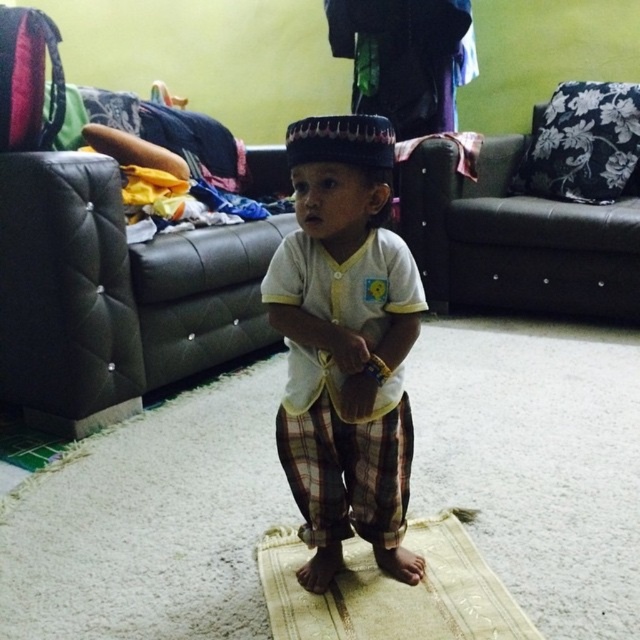
You are a parent trying to organize your child room. You see the white cotton shirt at center and the beige woven mat at center. Which item is positioned to the left side?

The white cotton shirt at center is to the left of the beige woven mat at center.

You are a photographer setting up for a portrait. You notice the white cotton shirt at center and the beige woven mat at center in the scene. Which object should you focus on first to ensure it is in sharp focus if you want the closest object to be clear?

The white cotton shirt at center is closer to the viewer than the beige woven mat at center, so you should focus on the white cotton shirt at center first to ensure it is in sharp focus.

You are helping a child get dressed. The child is standing on the beige woven mat at center and wearing the white cotton shirt at center. Can you tell me if the shirt is covering the mat?

The white cotton shirt at center is positioned over beige woven mat at center, so yes, the shirt is covering the mat.